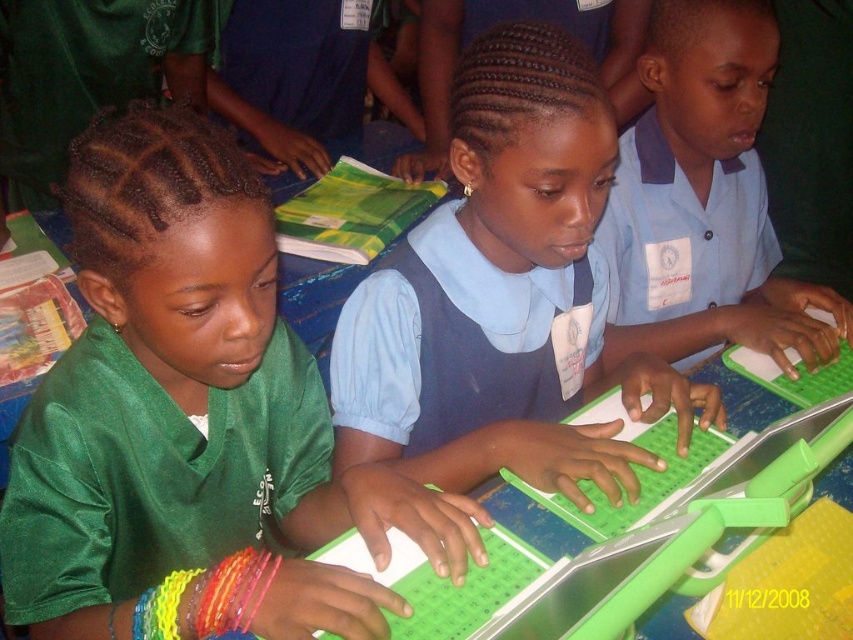
Is blue fabric shirt at center shorter than green plastic laptop at center?

Incorrect, blue fabric shirt at center's height does not fall short of green plastic laptop at center's.

Is blue fabric shirt at center wider than green plastic laptop at center?

No.

Which is behind, point (540, 106) or point (685, 490)?

Positioned behind is point (540, 106).

What are the coordinates of `blue fabric shirt at center` in the screenshot? It's located at pyautogui.click(x=503, y=296).

Is green shiny shirt at left positioned in front of green plastic laptop at center?

No, green shiny shirt at left is behind green plastic laptop at center.

Does green shiny shirt at left have a lesser height compared to green plastic laptop at center?

Incorrect, green shiny shirt at left's height does not fall short of green plastic laptop at center's.

Between point (202, 353) and point (836, 397), which one is positioned in front?

Positioned in front is point (202, 353).

Image resolution: width=853 pixels, height=640 pixels. I want to click on green shiny shirt at left, so click(190, 420).

Can you confirm if green shiny shirt at left is positioned to the right of blue fabric shirt at center?

No, green shiny shirt at left is not to the right of blue fabric shirt at center.

Does point (134, 115) come closer to viewer compared to point (553, 348)?

Yes, point (134, 115) is in front of point (553, 348).

This screenshot has width=853, height=640. What are the coordinates of `green shiny shirt at left` in the screenshot? It's located at [x=190, y=420].